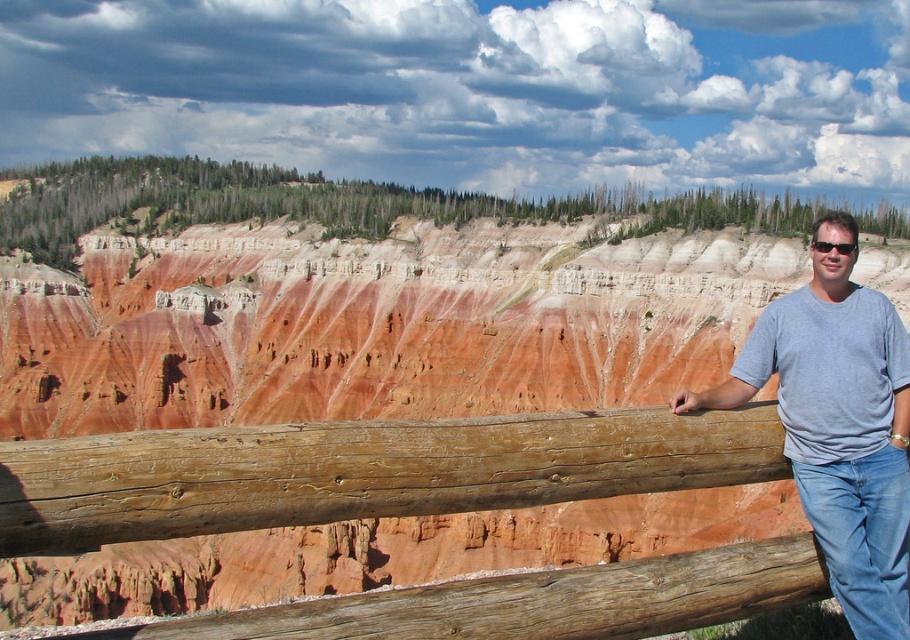
Question: Which point is closer to the camera?

Choices:
 (A) (502, 476)
 (B) (845, 557)

Answer: (A)

Question: Among these points, which one is nearest to the camera?

Choices:
 (A) (724, 412)
 (B) (901, 532)
 (C) (827, 244)

Answer: (B)

Question: Considering the relative positions of brown wooden fence at center and gray cotton t-shirt at right in the image provided, where is brown wooden fence at center located with respect to gray cotton t-shirt at right?

Choices:
 (A) left
 (B) right

Answer: (A)

Question: Considering the relative positions of brown wooden fence at center and gray cotton t-shirt at right in the image provided, where is brown wooden fence at center located with respect to gray cotton t-shirt at right?

Choices:
 (A) right
 (B) left

Answer: (B)

Question: Where is brown wooden fence at center located in relation to black plastic sunglasses at right in the image?

Choices:
 (A) above
 (B) below

Answer: (B)

Question: Estimate the real-world distances between objects in this image. Which object is closer to the black plastic sunglasses at right?

Choices:
 (A) brown wooden fence at center
 (B) gray cotton t-shirt at right

Answer: (B)